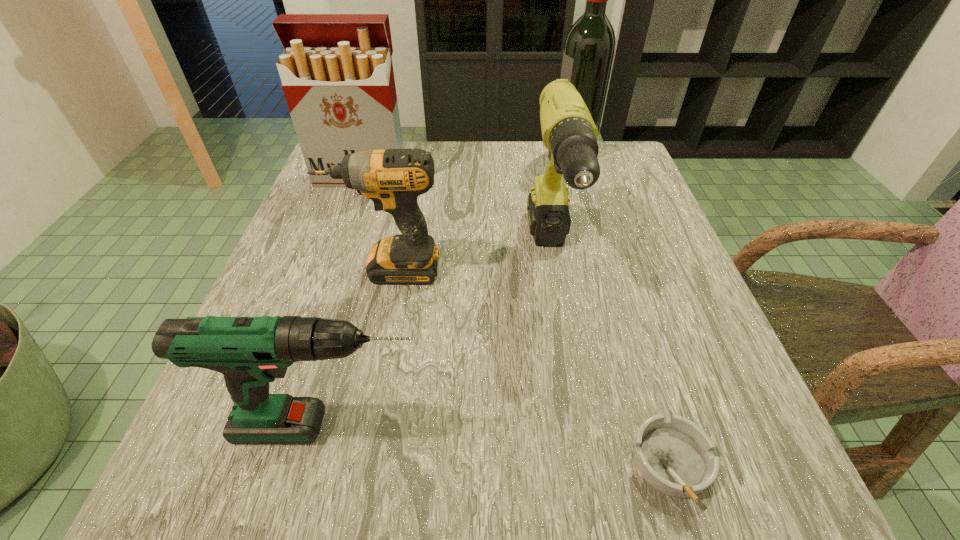
At what (x,y) coordinates should I click in order to perform the action: click on wine bottle. Please return your answer as a coordinate pair (x, y). Looking at the image, I should click on (588, 54).

Locate an element on the screen. The width and height of the screenshot is (960, 540). the tallest object is located at coordinates (588, 54).

The height and width of the screenshot is (540, 960). In order to click on cigarette case in this screenshot , I will do `click(337, 76)`.

Identify the location of the third object from right to left. Image resolution: width=960 pixels, height=540 pixels. (569, 133).

Find the location of `the rightmost drill`. the rightmost drill is located at coordinates (569, 133).

You are a GUI agent. You are given a task and a screenshot of the screen. Output one action in this format:
    pyautogui.click(x=<x>, y=<y>)
    Task: Click on the nearest drill
    This screenshot has width=960, height=540.
    Given the screenshot: What is the action you would take?
    pyautogui.click(x=250, y=352)

This screenshot has width=960, height=540. What are the coordinates of `ashtray` in the screenshot? It's located at (674, 455).

The width and height of the screenshot is (960, 540). I want to click on free space located 0.240m on the label of the tallest object, so click(x=456, y=153).

What are the coordinates of `vacant space located on the label of the tallest object` in the screenshot? It's located at (465, 153).

I want to click on vacant region located on the label of the tallest object, so click(417, 153).